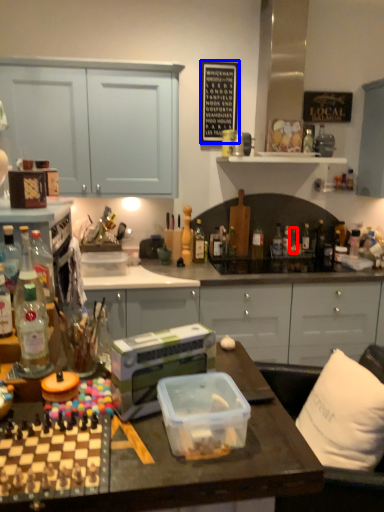
Question: Which point is further to the camera, bottle (highlighted by a red box) or bulletin board (highlighted by a blue box)?

Choices:
 (A) bottle
 (B) bulletin board

Answer: (A)